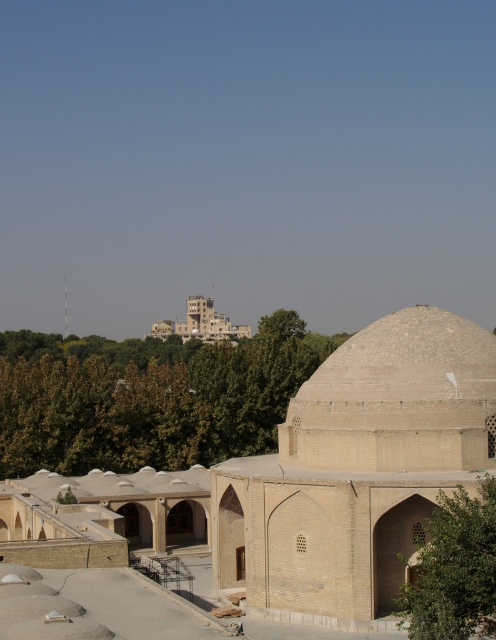
Find the location of a particular element. green leafy tree at center is located at coordinates (151, 401).

Is green leafy tree at center below beige stone dome at lower right?

Actually, green leafy tree at center is above beige stone dome at lower right.

The image size is (496, 640). I want to click on green leafy tree at center, so click(x=151, y=401).

Who is shorter, beige brick mosque at center or beige stone dome at lower right?

beige stone dome at lower right is shorter.

Is beige brick mosque at center below beige stone dome at lower right?

Correct, beige brick mosque at center is located below beige stone dome at lower right.

This screenshot has width=496, height=640. Identify the location of beige brick mosque at center. click(338, 474).

Where is `beige brick mosque at center`? The width and height of the screenshot is (496, 640). beige brick mosque at center is located at coordinates (338, 474).

Is beige brick mosque at center above green leafy tree at center?

No.

Does beige brick mosque at center have a smaller size compared to green leafy tree at center?

Yes, beige brick mosque at center is smaller than green leafy tree at center.

What do you see at coordinates (338, 474) in the screenshot?
I see `beige brick mosque at center` at bounding box center [338, 474].

Identify the location of beige brick mosque at center. (338, 474).